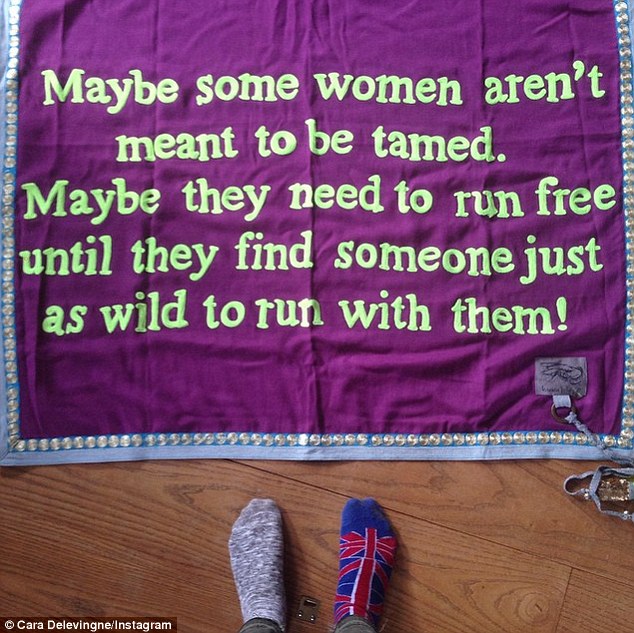
At what (x,y) coordinates should I click in order to perform the action: click on purple blanket. Please return your answer as a coordinate pair (x, y). Image resolution: width=634 pixels, height=633 pixels. Looking at the image, I should click on (328, 354).